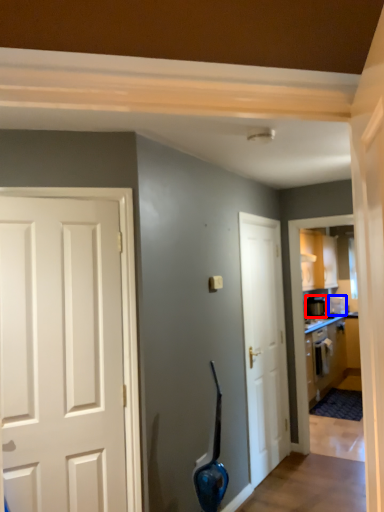
Question: Which object appears closest to the camera in this image, appliance (highlighted by a red box) or appliance (highlighted by a blue box)?

Choices:
 (A) appliance
 (B) appliance

Answer: (A)